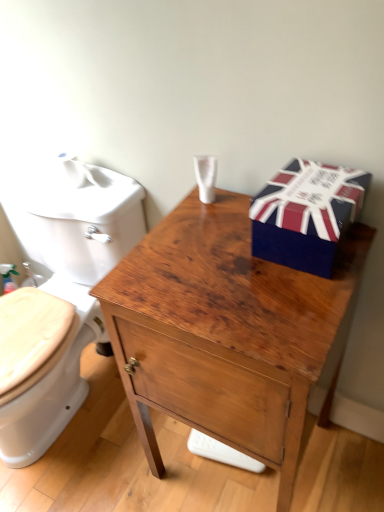
This screenshot has height=512, width=384. Find the location of `wooden cabinet at center`. wooden cabinet at center is located at coordinates (228, 332).

What do you see at coordinates (228, 332) in the screenshot? I see `wooden cabinet at center` at bounding box center [228, 332].

Identify the location of wooden cabinet at center. (228, 332).

Does union jack-patterned cardboard box at upper right appear on the right side of white glossy toilet at left?

Correct, you'll find union jack-patterned cardboard box at upper right to the right of white glossy toilet at left.

Is union jack-patterned cardboard box at upper right taller than white glossy toilet at left?

No, union jack-patterned cardboard box at upper right is not taller than white glossy toilet at left.

Is union jack-patterned cardboard box at upper right wider or thinner than white glossy toilet at left?

union jack-patterned cardboard box at upper right is thinner than white glossy toilet at left.

From the image's perspective, is union jack-patterned cardboard box at upper right located above or below white glossy toilet at left?

Based on their image positions, union jack-patterned cardboard box at upper right is located above white glossy toilet at left.

Find the location of a particular element. table lying in front of the white glossy toilet at left is located at coordinates click(228, 332).

From the picture: Visually, is wooden cabinet at center positioned to the left or to the right of white glossy toilet at left?

wooden cabinet at center is positioned on white glossy toilet at left's right side.

Which point is more distant from viewer, (122, 298) or (94, 216)?

The point (94, 216) is behind.

Which is more to the left, white glossy toilet at left or union jack-patterned cardboard box at upper right?

From the viewer's perspective, white glossy toilet at left appears more on the left side.

Looking at their sizes, would you say white glossy toilet at left is wider or thinner than union jack-patterned cardboard box at upper right?

Clearly, white glossy toilet at left has more width compared to union jack-patterned cardboard box at upper right.

Which is closer, (60, 245) or (353, 199)?

The point (353, 199) is in front.

Is white glossy toilet at left oriented towards union jack-patterned cardboard box at upper right?

No, white glossy toilet at left does not turn towards union jack-patterned cardboard box at upper right.

How different are the orientations of union jack-patterned cardboard box at upper right and wooden cabinet at center in degrees?

They differ by 3.4 degrees in their facing directions.

Is union jack-patterned cardboard box at upper right shorter than wooden cabinet at center?

Indeed, union jack-patterned cardboard box at upper right has a lesser height compared to wooden cabinet at center.

The width and height of the screenshot is (384, 512). In the image, there is a union jack-patterned cardboard box at upper right. Identify the location of table below it (from the image's perspective). (228, 332).

From a real-world perspective, is union jack-patterned cardboard box at upper right physically located above or below wooden cabinet at center?

Clearly, from a real-world perspective, union jack-patterned cardboard box at upper right is above wooden cabinet at center.

How much distance is there between wooden cabinet at center and union jack-patterned cardboard box at upper right?

8.61 inches.

Is wooden cabinet at center situated inside union jack-patterned cardboard box at upper right or outside?

wooden cabinet at center is not inside union jack-patterned cardboard box at upper right, it's outside.

Is wooden cabinet at center facing towards union jack-patterned cardboard box at upper right?

No, wooden cabinet at center does not turn towards union jack-patterned cardboard box at upper right.

Which object is positioned more to the left, wooden cabinet at center or union jack-patterned cardboard box at upper right?

From the viewer's perspective, wooden cabinet at center appears more on the left side.

How many degrees apart are the facing directions of white glossy toilet at left and wooden cabinet at center?

The facing directions of white glossy toilet at left and wooden cabinet at center are 0.56 degrees apart.

Locate an element on the screen. table lying below the white glossy toilet at left (from the image's perspective) is located at coordinates (228, 332).

Is white glossy toilet at left in contact with wooden cabinet at center?

white glossy toilet at left and wooden cabinet at center are clearly separated.

From the image's perspective, is white glossy toilet at left beneath wooden cabinet at center?

No.

This screenshot has width=384, height=512. What are the coordinates of `gift box that appears above the white glossy toilet at left (from a real-world perspective)` in the screenshot? It's located at (306, 214).

This screenshot has width=384, height=512. In order to click on table in front of the white glossy toilet at left in this screenshot , I will do `click(228, 332)`.

Estimate the real-world distances between objects in this image. Which object is further from union jack-patterned cardboard box at upper right, white glossy toilet at left or wooden cabinet at center?

white glossy toilet at left is positioned further to the anchor union jack-patterned cardboard box at upper right.

Estimate the real-world distances between objects in this image. Which object is further from white glossy toilet at left, wooden cabinet at center or union jack-patterned cardboard box at upper right?

Based on the image, union jack-patterned cardboard box at upper right appears to be further to white glossy toilet at left.

Based on their spatial positions, is wooden cabinet at center or white glossy toilet at left closer to union jack-patterned cardboard box at upper right?

wooden cabinet at center.

Which object lies nearer to the anchor point wooden cabinet at center, union jack-patterned cardboard box at upper right or white glossy toilet at left?

union jack-patterned cardboard box at upper right.

In the scene shown: Considering their positions, is white glossy toilet at left positioned closer to wooden cabinet at center than union jack-patterned cardboard box at upper right?

Among the two, union jack-patterned cardboard box at upper right is located nearer to wooden cabinet at center.

Considering their positions, is union jack-patterned cardboard box at upper right positioned closer to white glossy toilet at left than wooden cabinet at center?

wooden cabinet at center is closer to white glossy toilet at left.

This screenshot has height=512, width=384. I want to click on table located between white glossy toilet at left and union jack-patterned cardboard box at upper right in the left-right direction, so pyautogui.click(x=228, y=332).